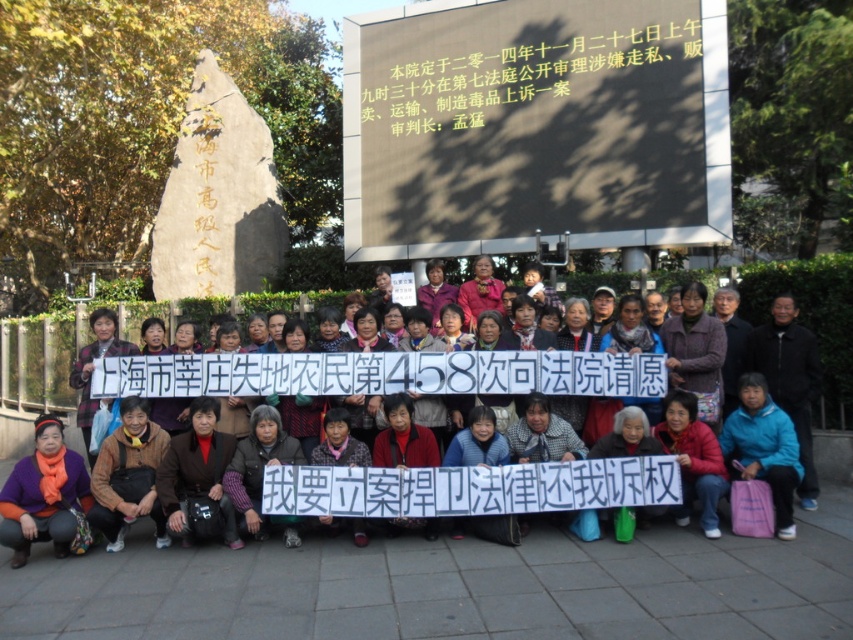
You are a photographer trying to capture a clear shot of both the blue fabric scarf at center and the orange scarf at lower left. Since you want to ensure both are visible, which scarf should you focus on first to account for their sizes?

The blue fabric scarf at center has a greater height compared to orange scarf at lower left, so you should focus on the blue fabric scarf at center first as it is larger and will require more attention to capture its details clearly.

You are a photographer standing at the edge of the protest area. You want to take a photo that includes both the blue fabric scarf at center and the orange scarf at lower left. The camera you are using has a maximum focus range of 5 meters. Can you capture both objects in a single focused shot?

The blue fabric scarf at center and orange scarf at lower left are 5.18 meters apart from each other. Since the camera can only focus up to 5 meters, the distance between them exceeds the maximum focus range. Therefore, it is not possible to capture both objects in a single focused shot.

You are a photographer trying to capture a closeup shot of both the blue fabric scarf at center and the orange scarf at lower left. Which scarf should you zoom in on first to ensure both are in frame?

You should first zoom in on the orange scarf at lower left because it is smaller in size compared to the blue fabric scarf at center, ensuring both fit within the camera frame.